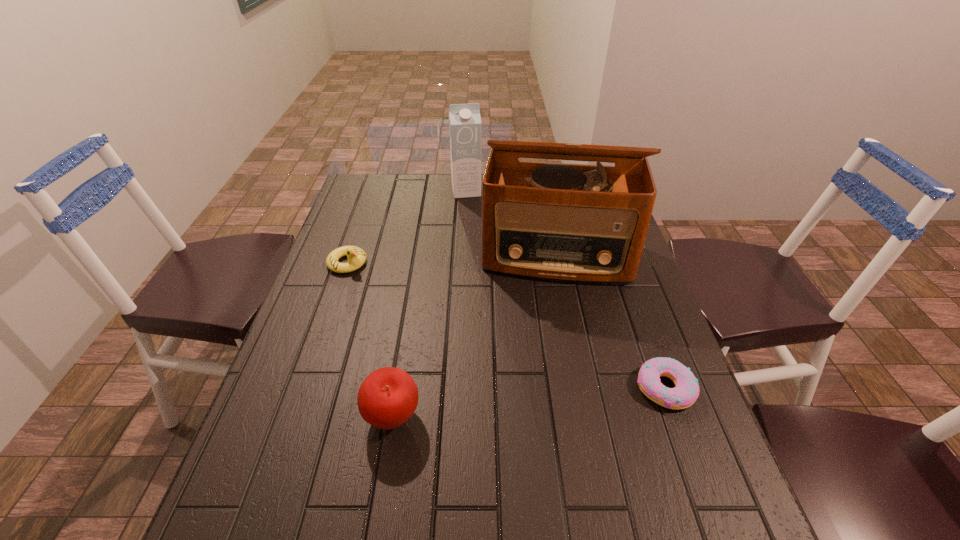
In order to click on object that is the closest to the second tallest object in this screenshot , I will do `click(580, 223)`.

The width and height of the screenshot is (960, 540). Identify the location of vacant position in the image that satisfies the following two spatial constraints: 1. on the back side of the apple; 2. on the right side of the shortest object. (397, 387).